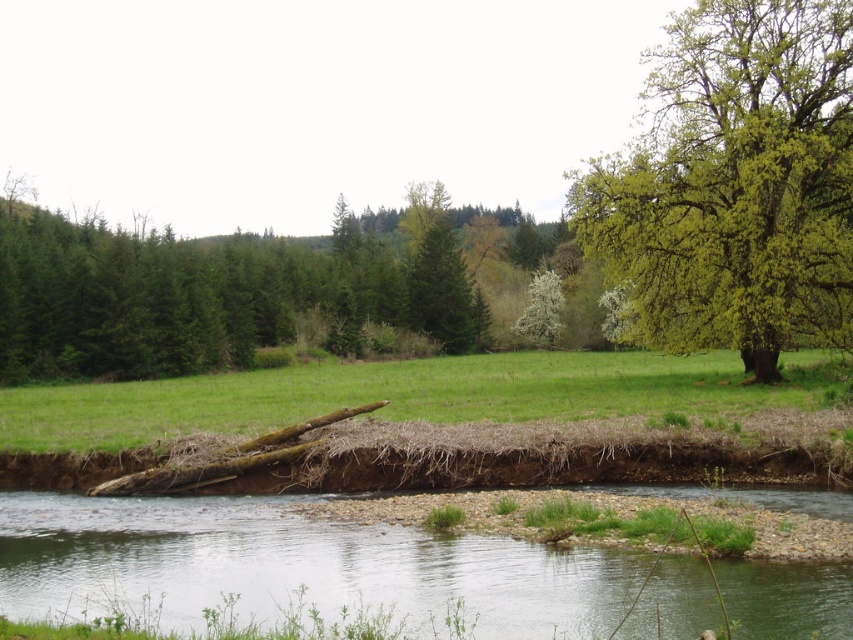
I want to click on green leafy tree at right, so click(735, 180).

Which is behind, point (595, 250) or point (780, 422)?

Point (595, 250)

Identify the location of green leafy tree at right. (735, 180).

Who is positioned more to the left, clear water at center or white blossoming tree at center?

clear water at center is more to the left.

Can you confirm if clear water at center is positioned below white blossoming tree at center?

Yes.

Is point (785, 593) farther from viewer compared to point (532, 280)?

No, it is not.

What are the coordinates of `clear water at center` in the screenshot? It's located at (294, 564).

Who is positioned more to the right, clear water at center or green matte tree at center?

From the viewer's perspective, clear water at center appears more on the right side.

Is clear water at center in front of green matte tree at center?

Yes, it is.

The image size is (853, 640). Describe the element at coordinates (294, 564) in the screenshot. I see `clear water at center` at that location.

Where is `clear water at center`? clear water at center is located at coordinates (294, 564).